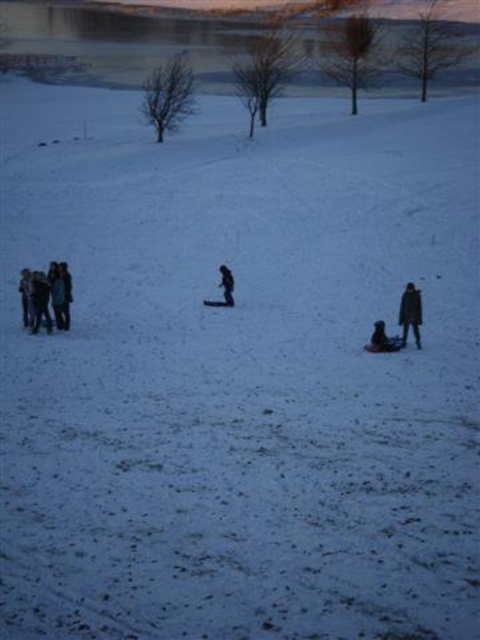
Is dark gray jacket at lower right further to the viewer compared to black matte jacket at center?

No, it is in front of black matte jacket at center.

Does dark gray jacket at lower right have a greater width compared to black matte jacket at center?

Indeed, dark gray jacket at lower right has a greater width compared to black matte jacket at center.

Does point (384, 333) lie in front of point (220, 264)?

That is True.

I want to click on dark gray jacket at lower right, so click(x=383, y=339).

Consider the image. Is brown wool coat at right above black matte jacket at center?

No, brown wool coat at right is not above black matte jacket at center.

Does brown wool coat at right have a smaller size compared to black matte jacket at center?

Incorrect, brown wool coat at right is not smaller in size than black matte jacket at center.

The height and width of the screenshot is (640, 480). What do you see at coordinates (410, 312) in the screenshot? I see `brown wool coat at right` at bounding box center [410, 312].

Locate an element on the screen. The width and height of the screenshot is (480, 640). brown wool coat at right is located at coordinates (410, 312).

Between point (404, 326) and point (388, 344), which one is positioned in front?

Point (388, 344)

Describe the element at coordinates (410, 312) in the screenshot. This screenshot has height=640, width=480. I see `brown wool coat at right` at that location.

This screenshot has height=640, width=480. I want to click on brown wool coat at right, so coord(410,312).